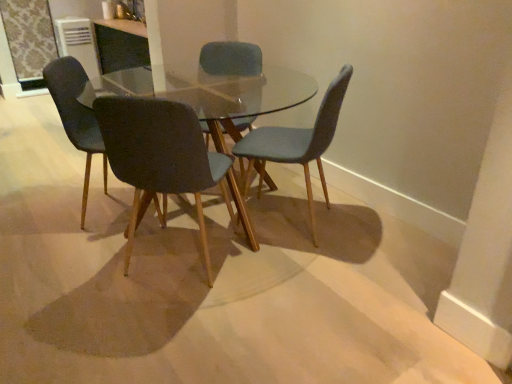
Question: Could you tell me if matte blue chair at center, which is counted as the 3th chair, starting from the left, is facing matte black chair at left, the 4th chair positioned from the right?

Choices:
 (A) yes
 (B) no

Answer: (B)

Question: Can you see matte blue chair at center, which is the second chair in right-to-left order, touching matte black chair at left, the 4th chair positioned from the right?

Choices:
 (A) yes
 (B) no

Answer: (B)

Question: Are matte blue chair at center, which is counted as the 3th chair, starting from the left, and matte black chair at left, the 4th chair positioned from the right, located far from each other?

Choices:
 (A) no
 (B) yes

Answer: (A)

Question: From a real-world perspective, does matte blue chair at center, which is counted as the 3th chair, starting from the left, stand above matte black chair at left, arranged as the first chair when viewed from the left?

Choices:
 (A) yes
 (B) no

Answer: (A)

Question: Does matte blue chair at center, which is the second chair in right-to-left order, appear on the left side of matte black chair at left, arranged as the first chair when viewed from the left?

Choices:
 (A) yes
 (B) no

Answer: (B)

Question: Is matte black chair at left, the 4th chair positioned from the right, taller or shorter than matte blue chair at center, marked as the first chair in a right-to-left arrangement?

Choices:
 (A) short
 (B) tall

Answer: (B)

Question: From the image's perspective, is matte black chair at left, arranged as the first chair when viewed from the left, above or below matte blue chair at center, marked as the first chair in a right-to-left arrangement?

Choices:
 (A) above
 (B) below

Answer: (A)

Question: Based on their sizes in the image, would you say matte black chair at left, the 4th chair positioned from the right, is bigger or smaller than matte blue chair at center, the fourth chair from the left?

Choices:
 (A) big
 (B) small

Answer: (A)

Question: In the image, is matte black chair at left, the 4th chair positioned from the right, positioned in front of or behind matte blue chair at center, marked as the first chair in a right-to-left arrangement?

Choices:
 (A) front
 (B) behind

Answer: (B)

Question: From a real-world perspective, relative to matte black chair at left, arranged as the first chair when viewed from the left, is clear glass table at center vertically above or below?

Choices:
 (A) below
 (B) above

Answer: (A)

Question: Considering the positions of clear glass table at center and matte black chair at left, the 4th chair positioned from the right, in the image, is clear glass table at center bigger or smaller than matte black chair at left, the 4th chair positioned from the right,?

Choices:
 (A) big
 (B) small

Answer: (A)

Question: Is clear glass table at center situated inside matte black chair at left, arranged as the first chair when viewed from the left, or outside?

Choices:
 (A) inside
 (B) outside

Answer: (B)

Question: Is clear glass table at center to the left or to the right of matte black chair at left, the 4th chair positioned from the right, in the image?

Choices:
 (A) right
 (B) left

Answer: (A)

Question: Considering the positions of matte black chair at left, arranged as the first chair when viewed from the left, and matte black chair at center, which is the 2th chair in left-to-right order, in the image, is matte black chair at left, arranged as the first chair when viewed from the left, bigger or smaller than matte black chair at center, which is the 2th chair in left-to-right order,?

Choices:
 (A) big
 (B) small

Answer: (A)

Question: Considering the positions of matte black chair at left, the 4th chair positioned from the right, and matte black chair at center, which is the 2th chair in left-to-right order, in the image, is matte black chair at left, the 4th chair positioned from the right, wider or thinner than matte black chair at center, which is the 2th chair in left-to-right order,?

Choices:
 (A) wide
 (B) thin

Answer: (B)